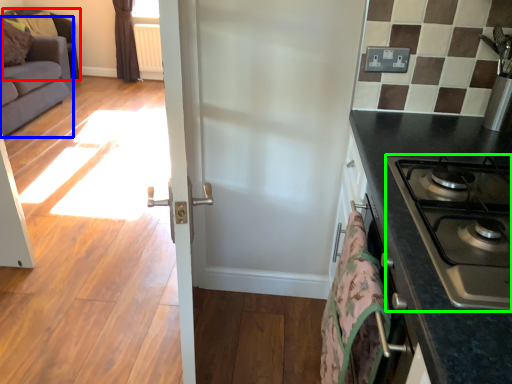
Question: Considering the real-world distances, which object is closest to armchair (highlighted by a red box)? studio couch (highlighted by a blue box) or gas stove (highlighted by a green box).

Choices:
 (A) studio couch
 (B) gas stove

Answer: (A)